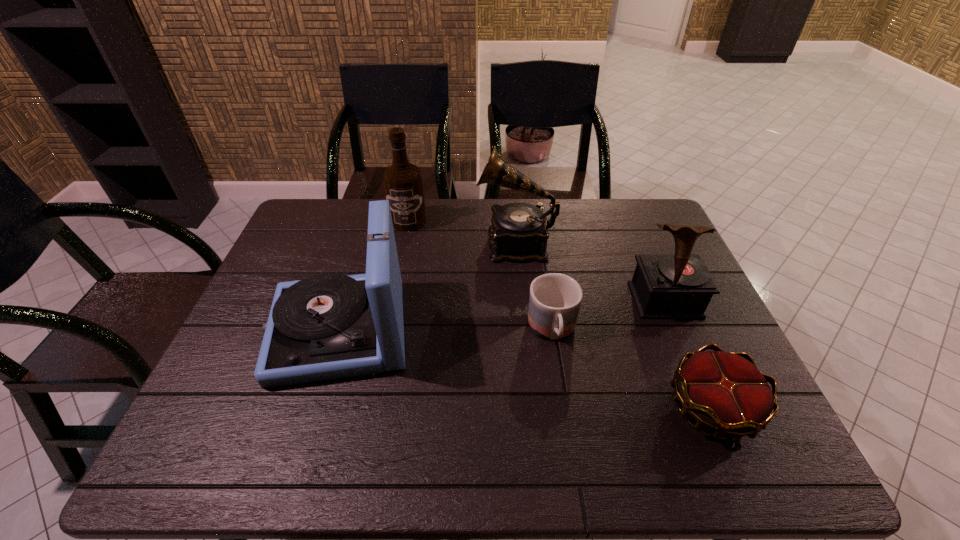
At what (x,y) coordinates should I click in order to perform the action: click on vacant space positioned 0.290m on the right of the leftmost phonograph_record. Please return your answer as a coordinate pair (x, y). This screenshot has height=540, width=960. Looking at the image, I should click on tap(522, 330).

Locate an element on the screen. free space located at the horn opening of the rightmost phonograph_record is located at coordinates (706, 395).

This screenshot has width=960, height=540. In order to click on free space located 0.070m on the side with the handle of the mug in this screenshot , I will do `click(561, 382)`.

At what (x,y) coordinates should I click in order to perform the action: click on vacant position located on the left of the crown. Please return your answer as a coordinate pair (x, y). The image size is (960, 540). Looking at the image, I should click on (542, 407).

Where is `alcohol at the far edge`? alcohol at the far edge is located at coordinates (403, 183).

The height and width of the screenshot is (540, 960). What are the coordinates of `phonograph record located at the far edge` in the screenshot? It's located at (518, 233).

The width and height of the screenshot is (960, 540). In order to click on object that is positioned at the near edge in this screenshot , I will do `click(725, 392)`.

You are a GUI agent. You are given a task and a screenshot of the screen. Output one action in this format:
    pyautogui.click(x=<x>, y=<y>)
    Task: Click on the object present at the left edge
    The width and height of the screenshot is (960, 540).
    Given the screenshot: What is the action you would take?
    pyautogui.click(x=328, y=326)

At what (x,y) coordinates should I click in order to perform the action: click on phonograph_record at the right edge. Please return your answer as a coordinate pair (x, y). Looking at the image, I should click on (664, 286).

You are a GUI agent. You are given a task and a screenshot of the screen. Output one action in this format:
    pyautogui.click(x=<x>, y=<y>)
    Task: Click on the crown positioned at the right edge
    The image size is (960, 540).
    Given the screenshot: What is the action you would take?
    pyautogui.click(x=725, y=392)